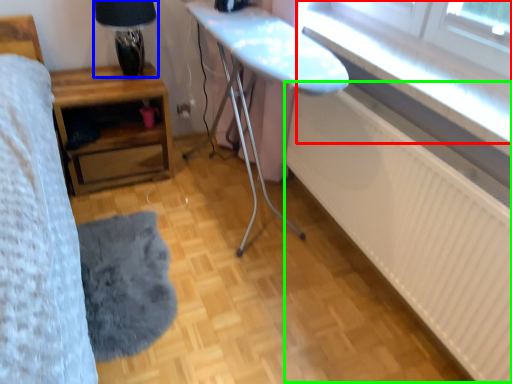
Question: Which is nearer to the window (highlighted by a red box)? table lamp (highlighted by a blue box) or radiator (highlighted by a green box).

Choices:
 (A) table lamp
 (B) radiator

Answer: (B)